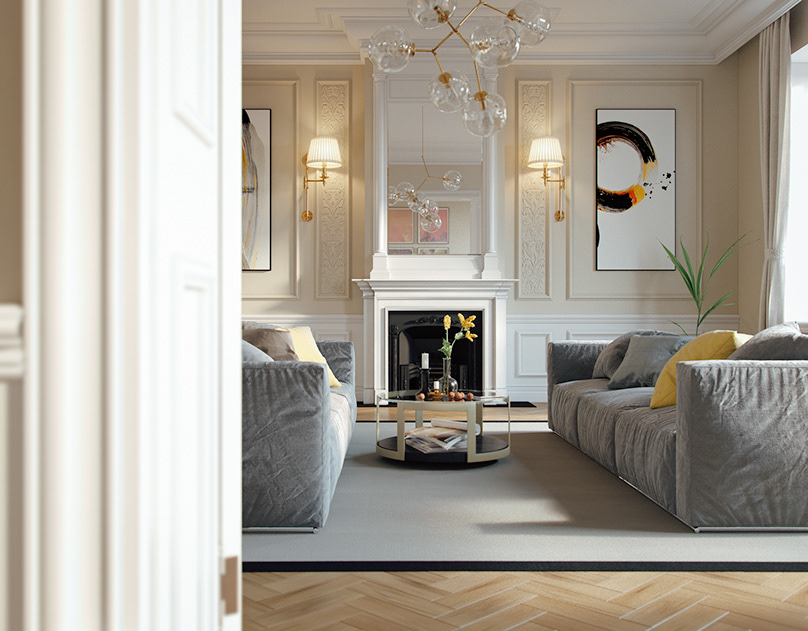
I want to click on couch, so click(x=766, y=461), click(x=321, y=462).